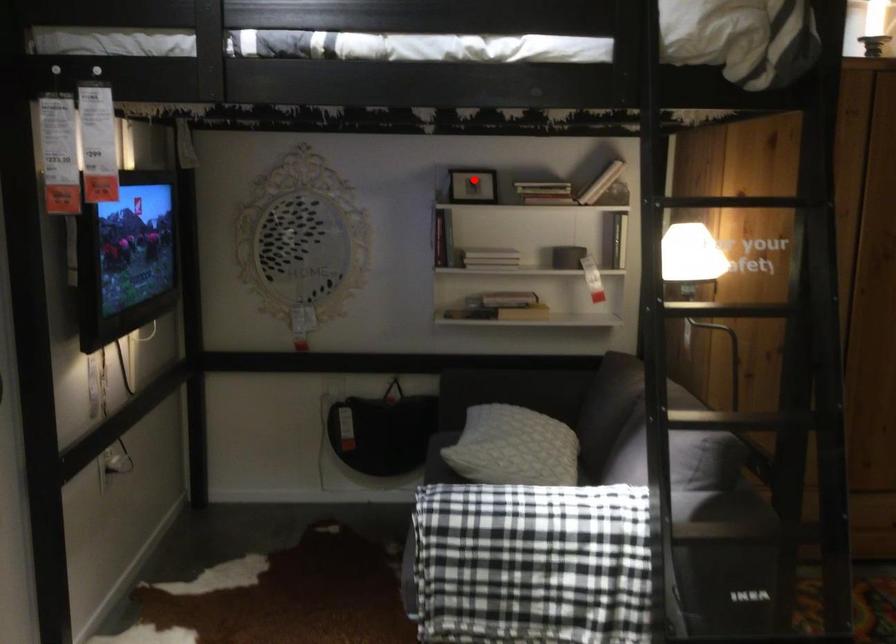
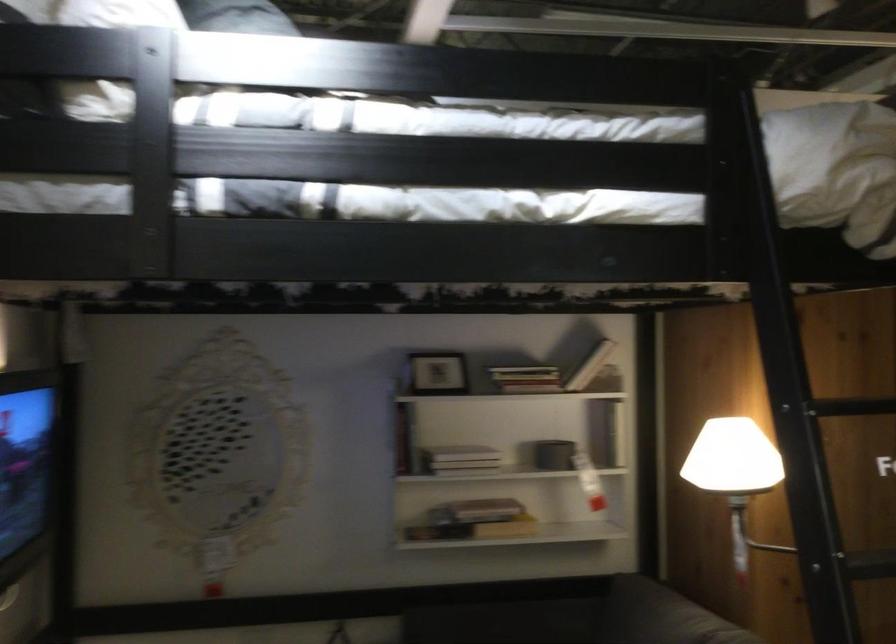
Question: I am providing you with two images of the same scene from different viewpoints. In image1, a red point is highlighted. Considering the same 3D point in image2, which of the following is correct?

Choices:
 (A) It is closer
 (B) It is farther

Answer: (A)